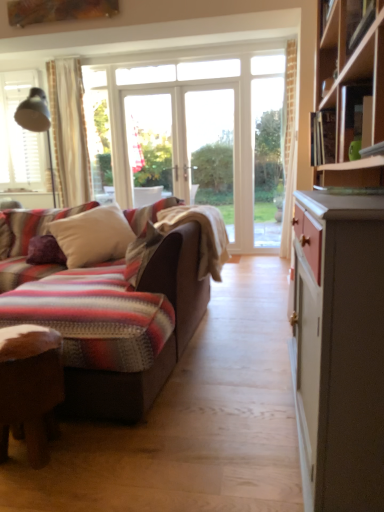
Question: Considering the relative positions of wooden desk at lower left and striped woolen blanket at center in the image provided, is wooden desk at lower left behind striped woolen blanket at center?

Choices:
 (A) yes
 (B) no

Answer: (B)

Question: From the image's perspective, is wooden desk at lower left beneath striped woolen blanket at center?

Choices:
 (A) no
 (B) yes

Answer: (B)

Question: Is wooden desk at lower left not close to striped woolen blanket at center?

Choices:
 (A) no
 (B) yes

Answer: (B)

Question: From the image's perspective, is wooden desk at lower left over striped woolen blanket at center?

Choices:
 (A) yes
 (B) no

Answer: (B)

Question: Is wooden desk at lower left turned away from striped woolen blanket at center?

Choices:
 (A) yes
 (B) no

Answer: (A)

Question: Does wooden desk at lower left have a greater width compared to striped woolen blanket at center?

Choices:
 (A) no
 (B) yes

Answer: (A)

Question: Considering the relative positions of white soft pillow at center, acting as the 1th pillow starting from the right, and wooden desk at lower left in the image provided, is white soft pillow at center, acting as the 1th pillow starting from the right, to the left of wooden desk at lower left from the viewer's perspective?

Choices:
 (A) no
 (B) yes

Answer: (B)

Question: Is white soft pillow at center, the second pillow in the left-to-right sequence, to the right of wooden desk at lower left from the viewer's perspective?

Choices:
 (A) no
 (B) yes

Answer: (A)

Question: Is the position of white soft pillow at center, the second pillow in the left-to-right sequence, less distant than that of wooden desk at lower left?

Choices:
 (A) no
 (B) yes

Answer: (A)

Question: Is white soft pillow at center, acting as the 1th pillow starting from the right, wider than wooden desk at lower left?

Choices:
 (A) no
 (B) yes

Answer: (B)

Question: Is white soft pillow at center, the second pillow in the left-to-right sequence, bigger than wooden desk at lower left?

Choices:
 (A) yes
 (B) no

Answer: (A)

Question: From the image's perspective, would you say white soft pillow at center, the second pillow in the left-to-right sequence, is shown under wooden desk at lower left?

Choices:
 (A) yes
 (B) no

Answer: (B)

Question: Considering the relative positions of purple velvet pillow at left, arranged as the second pillow when viewed from the right, and wooden desk at lower left in the image provided, is purple velvet pillow at left, arranged as the second pillow when viewed from the right, to the right of wooden desk at lower left from the viewer's perspective?

Choices:
 (A) yes
 (B) no

Answer: (B)